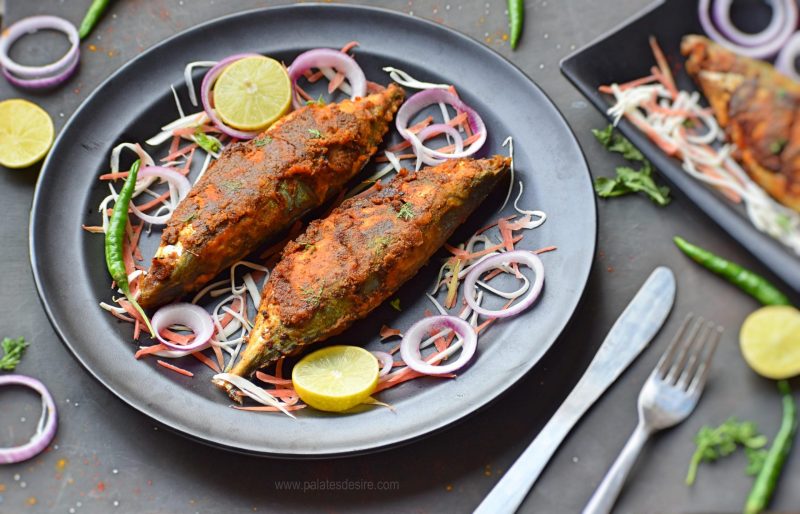
The height and width of the screenshot is (514, 800). Identify the location of silverware. (650, 412), (613, 363).